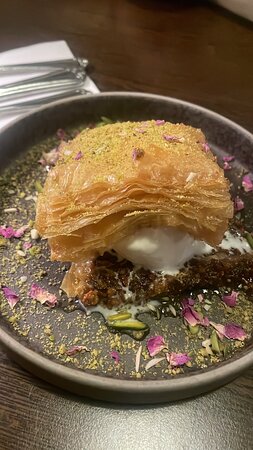
Find the location of `plate`. plate is located at coordinates pyautogui.click(x=222, y=384).